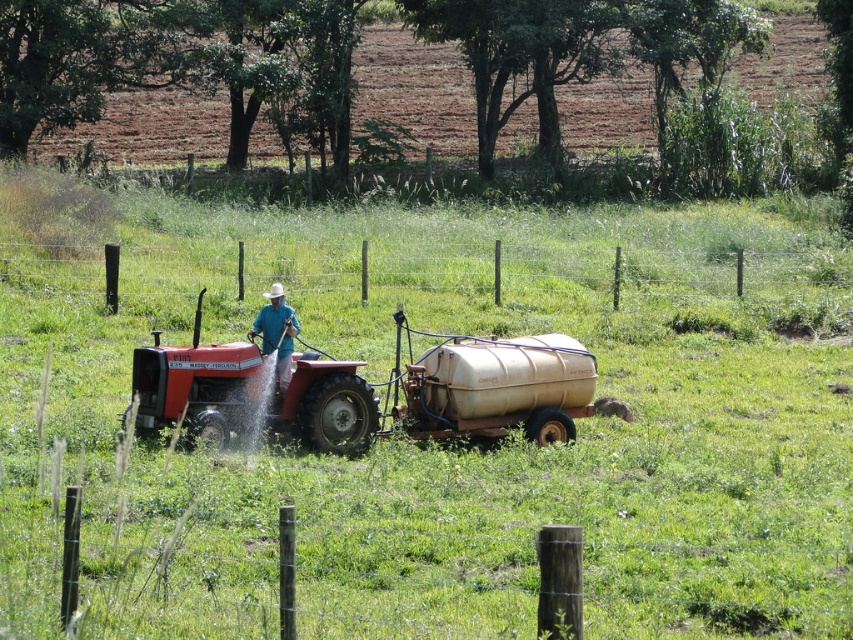
You are standing at the point marked by the coordinates (433, 442) in the image. Based on the scene described, what type of terrain are you currently standing on?

The point at coordinates (433, 442) is on green grass at center, so you are standing on grass.

Based on the scene described, which object is taller between the green grass at center and the matte red tractor at center?

The green grass at center is taller than the matte red tractor at center according to the description.